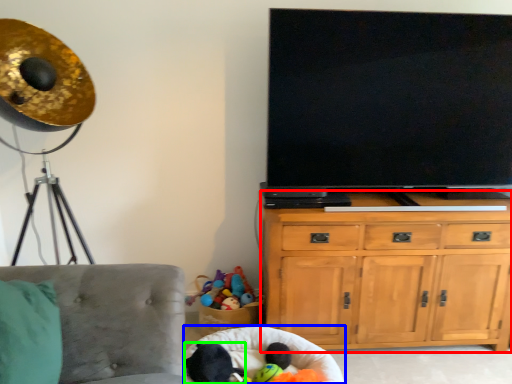
Question: Which object is positioned closest to cabinetry (highlighted by a red box)? Select from bean bag chair (highlighted by a blue box) and animal (highlighted by a green box).

Choices:
 (A) bean bag chair
 (B) animal

Answer: (A)